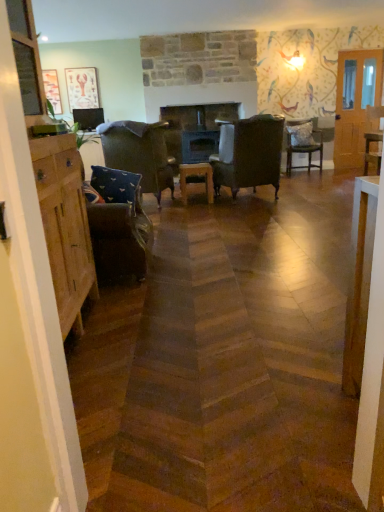
Question: From the image's perspective, relative to matte wooden picture frame at upper left, which is the 2th picture frame in right-to-left order, is textured gray pillow at center-right, the 2th pillow in the front-to-back sequence, above or below?

Choices:
 (A) below
 (B) above

Answer: (A)

Question: Does point (309, 131) appear closer or farther from the camera than point (48, 70)?

Choices:
 (A) closer
 (B) farther

Answer: (B)

Question: Which is farther from the brown leather chair at center, positioned as the second chair in left-to-right order?

Choices:
 (A) matte paper picture frame at upper left, the second picture frame when ordered from left to right
 (B) textured gray pillow at center-right, which appears as the first pillow when viewed from the back
 (C) patterned fabric chair at center-right, which is counted as the second chair, starting from the right
 (D) wooden chair at right, positioned as the 4th chair in left-to-right order
 (E) matte wooden picture frame at upper left, which is the first picture frame in left-to-right order

Answer: (E)

Question: Estimate the real-world distances between objects in this image. Which object is farther from the matte paper picture frame at upper left, the 1th picture frame viewed from the right?

Choices:
 (A) textured gray pillow at center-right, the 2th pillow ordered from the bottom
 (B) patterned fabric chair at center-right, arranged as the third chair when viewed from the left
 (C) smooth dark wood fireplace at center
 (D) brown leather chair at center, positioned as the second chair in left-to-right order
 (E) wooden stool at center

Answer: (A)